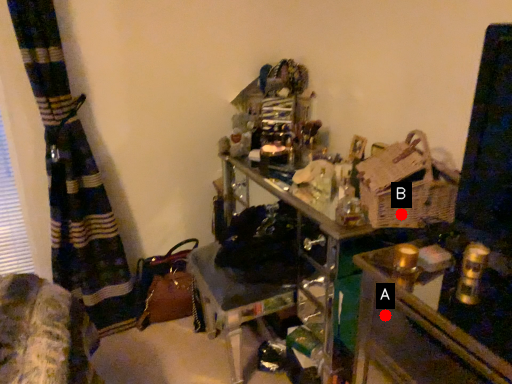
Question: Two points are circled on the image, labeled by A and B beside each circle. Which point is closer to the camera taking this photo?

Choices:
 (A) A is closer
 (B) B is closer

Answer: (A)